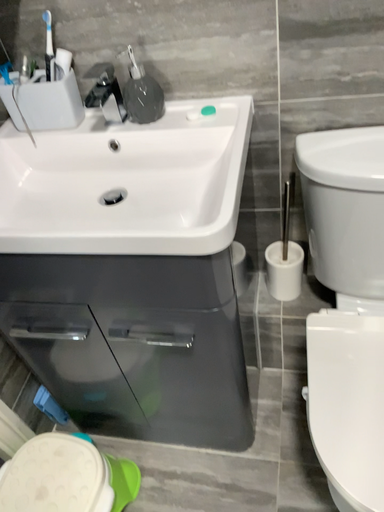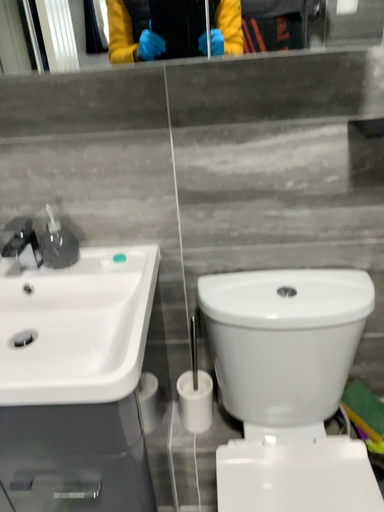
Question: How did the camera likely rotate when shooting the video?

Choices:
 (A) rotated left
 (B) rotated right

Answer: (B)